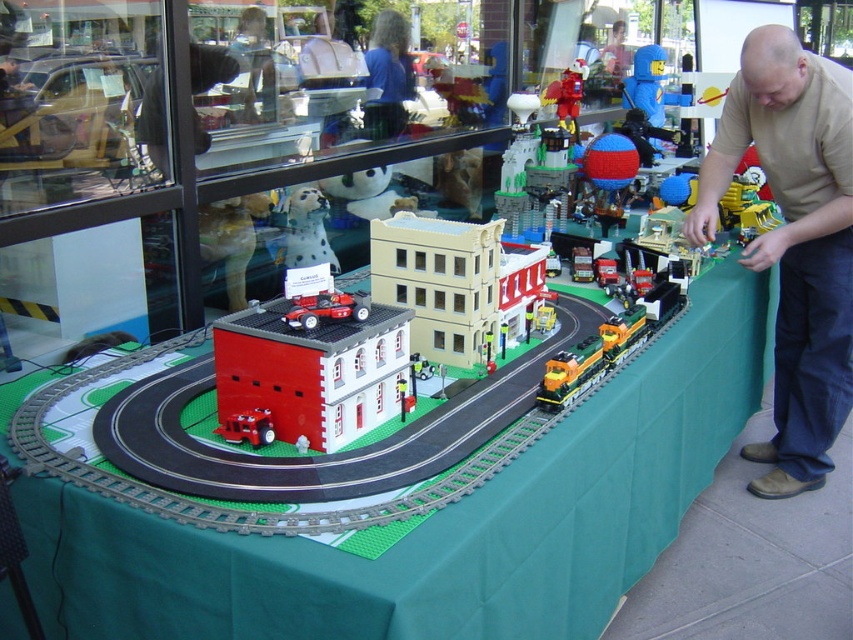
You are looking at the miniature model train set on the table. Where is the brown cotton shirt at right located in relation to the table?

The brown cotton shirt at right is located at point (x=793, y=241) on the table.

You are a visitor observing the miniature model train set on the table. You notice the brown cotton shirt at right and the white matte dog at upper center. Which object is taller in this scene?

The brown cotton shirt at right is much taller than the white matte dog at upper center.

You are looking at the miniature model train set on the table. Where is the brown cotton shirt at right located in terms of its 2D coordinates?

The brown cotton shirt at right is located at the 2D coordinates of point [793,241].